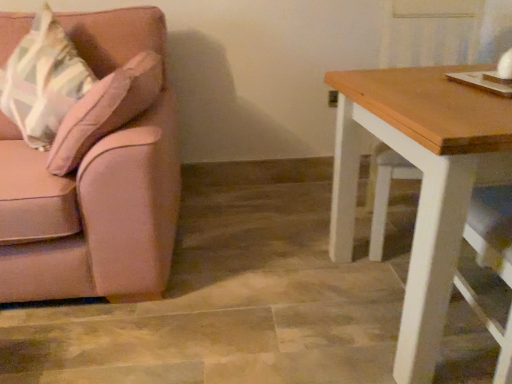
Identify the location of wooden table at right. This screenshot has height=384, width=512. [x=422, y=182].

What do you see at coordinates (91, 213) in the screenshot? I see `pink fabric couch at left` at bounding box center [91, 213].

Where is `matte pink throw pillow at left`? The width and height of the screenshot is (512, 384). matte pink throw pillow at left is located at coordinates (42, 81).

This screenshot has width=512, height=384. Find the location of `wooden table at right`. wooden table at right is located at coordinates (422, 182).

Which is more to the right, wooden table at right or matte pink throw pillow at left?

Positioned to the right is wooden table at right.

From the image's perspective, between wooden table at right and matte pink throw pillow at left, which one is located above?

matte pink throw pillow at left.

How much distance is there between wooden table at right and matte pink throw pillow at left?

A distance of 1.12 meters exists between wooden table at right and matte pink throw pillow at left.

Is wooden table at right inside or outside of matte pink throw pillow at left?

wooden table at right lies outside matte pink throw pillow at left.

What's the angular difference between matte pink throw pillow at left and pink fabric couch at left's facing directions?

They differ by 22.8 degrees in their facing directions.

From the image's perspective, which object appears higher, matte pink throw pillow at left or pink fabric couch at left?

matte pink throw pillow at left appears higher in the image.

From a real-world perspective, which is physically below, matte pink throw pillow at left or pink fabric couch at left?

pink fabric couch at left, from a real-world perspective.

In the scene shown: Who is bigger, matte pink throw pillow at left or pink fabric couch at left?

With larger size is pink fabric couch at left.

From a real-world perspective, is pink fabric couch at left located higher than wooden table at right?

Yes, from a real-world perspective, pink fabric couch at left is over wooden table at right

From the picture: Does pink fabric couch at left have a lesser width compared to wooden table at right?

Incorrect, the width of pink fabric couch at left is not less than that of wooden table at right.

Between pink fabric couch at left and wooden table at right, which one has less height?

Standing shorter between the two is wooden table at right.

Consider the image. Can you tell me how much pink fabric couch at left and wooden table at right differ in facing direction?

pink fabric couch at left and wooden table at right are facing 2.82 degrees away from each other.

Considering the sizes of objects pink fabric couch at left and matte pink throw pillow at left in the image provided, who is smaller, pink fabric couch at left or matte pink throw pillow at left?

matte pink throw pillow at left is smaller.

You are a GUI agent. You are given a task and a screenshot of the screen. Output one action in this format:
    pyautogui.click(x=<x>, y=<y>)
    Task: Click on the chair that is in front of the matte pink throw pillow at left
    Image resolution: width=512 pixels, height=384 pixels.
    Given the screenshot: What is the action you would take?
    pyautogui.click(x=91, y=213)

Which of these two, pink fabric couch at left or matte pink throw pillow at left, stands taller?

pink fabric couch at left.

Is wooden table at right positioned with its back to pink fabric couch at left?

wooden table at right is not turned away from pink fabric couch at left.

Is wooden table at right surrounding pink fabric couch at left?

No, pink fabric couch at left is not inside wooden table at right.

From the image's perspective, is wooden table at right below pink fabric couch at left?

Yes.

Considering the relative sizes of matte pink throw pillow at left and wooden table at right in the image provided, is matte pink throw pillow at left wider than wooden table at right?

In fact, matte pink throw pillow at left might be narrower than wooden table at right.

Is matte pink throw pillow at left completely or partially outside of wooden table at right?

Yes, matte pink throw pillow at left is outside of wooden table at right.

Is matte pink throw pillow at left facing towards wooden table at right?

No, matte pink throw pillow at left is not facing towards wooden table at right.

From the image's perspective, between matte pink throw pillow at left and wooden table at right, who is located below?

wooden table at right.

The image size is (512, 384). I want to click on table that is on the right side of matte pink throw pillow at left, so click(422, 182).

Where is `throw pillow above the pink fabric couch at left (from a real-world perspective)`? throw pillow above the pink fabric couch at left (from a real-world perspective) is located at coordinates point(42,81).

From the image, which object appears to be farther from matte pink throw pillow at left, pink fabric couch at left or wooden table at right?

wooden table at right is further to matte pink throw pillow at left.

Based on their spatial positions, is wooden table at right or pink fabric couch at left further from matte pink throw pillow at left?

Among the two, wooden table at right is located further to matte pink throw pillow at left.

Which object lies further to the anchor point wooden table at right, pink fabric couch at left or matte pink throw pillow at left?

matte pink throw pillow at left is further to wooden table at right.

Considering their positions, is matte pink throw pillow at left positioned closer to wooden table at right than pink fabric couch at left?

pink fabric couch at left is closer to wooden table at right.

Looking at the image, which one is located closer to pink fabric couch at left, wooden table at right or matte pink throw pillow at left?

Based on the image, matte pink throw pillow at left appears to be nearer to pink fabric couch at left.

When comparing their distances from pink fabric couch at left, does matte pink throw pillow at left or wooden table at right seem further?

wooden table at right lies further to pink fabric couch at left than the other object.

Where is `throw pillow between pink fabric couch at left and wooden table at right from left to right`? throw pillow between pink fabric couch at left and wooden table at right from left to right is located at coordinates click(x=42, y=81).